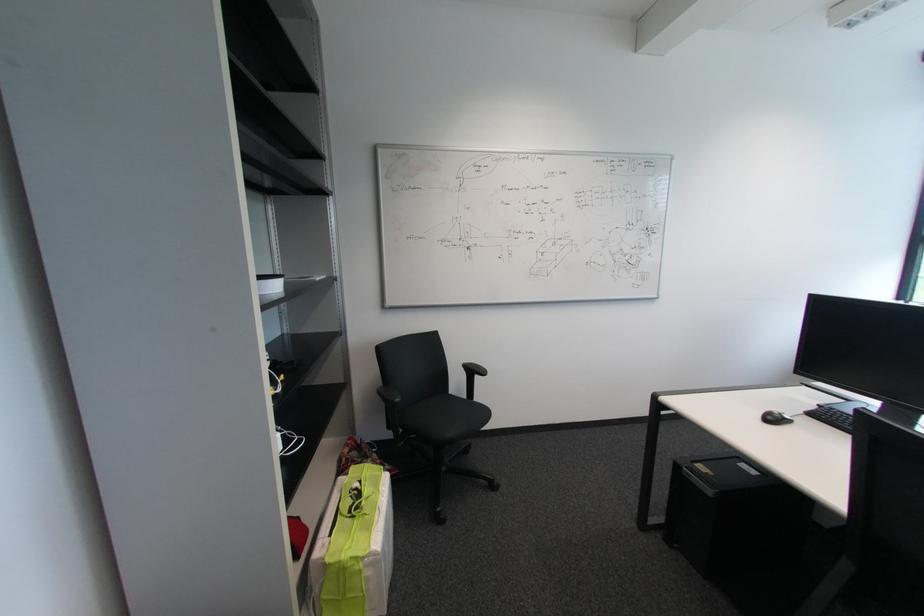
Where is `black chair sitting surface`? The image size is (924, 616). black chair sitting surface is located at coordinates (444, 419).